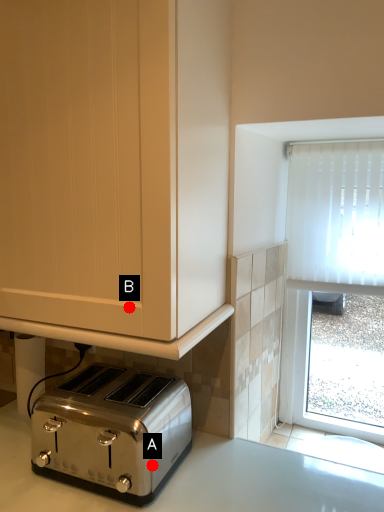
Question: Two points are circled on the image, labeled by A and B beside each circle. Among these points, which one is farthest from the camera?

Choices:
 (A) A is further
 (B) B is further

Answer: (A)